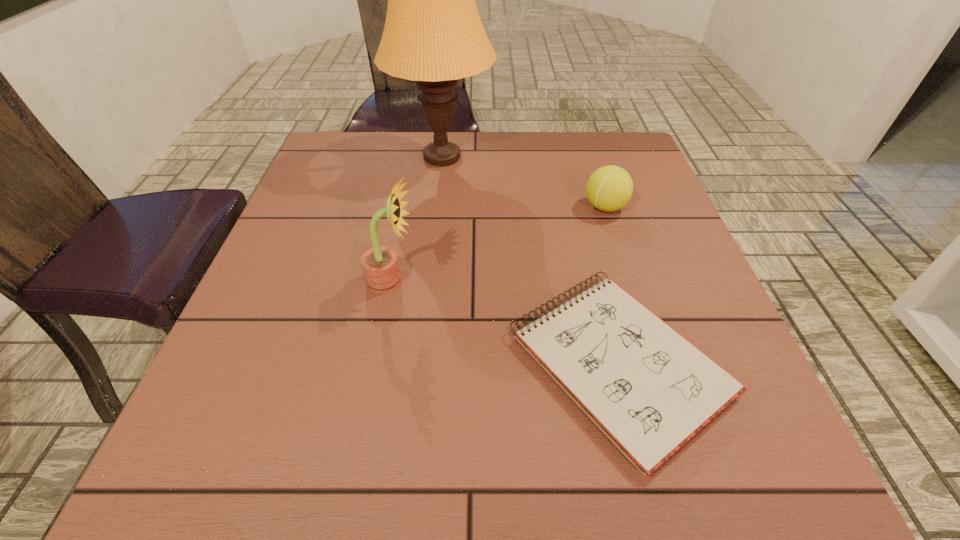
Locate which object is the third closest to the tennis ball. Please provide its 2D coordinates. Your answer should be formatted as a tuple, i.e. [(x, y)], where the tuple contains the x and y coordinates of a point satisfying the conditions above.

[(380, 266)]

Image resolution: width=960 pixels, height=540 pixels. I want to click on object that stands as the second closest to the lampshade, so click(x=380, y=266).

Locate an element on the screen. free location that satisfies the following two spatial constraints: 1. on the back side of the tennis ball; 2. on the left side of the notepad is located at coordinates (579, 207).

I want to click on vacant area in the image that satisfies the following two spatial constraints: 1. on the front side of the second shortest object; 2. on the face of the sunflower, so click(629, 281).

Image resolution: width=960 pixels, height=540 pixels. What are the coordinates of `vacant space that satisfies the following two spatial constraints: 1. on the face of the shortest object; 2. on the right side of the sunflower` in the screenshot? It's located at (375, 363).